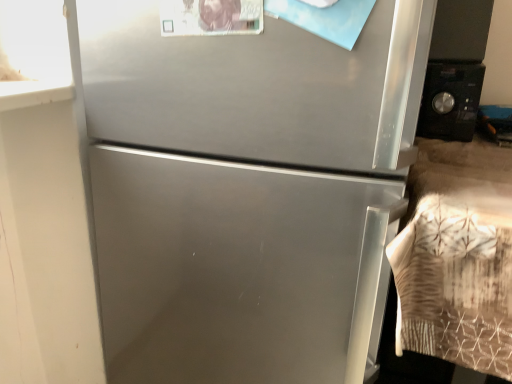
Find the location of a particular element. This screenshot has width=512, height=384. satin silver refrigerator at center is located at coordinates (247, 191).

The width and height of the screenshot is (512, 384). Describe the element at coordinates (247, 191) in the screenshot. I see `satin silver refrigerator at center` at that location.

This screenshot has height=384, width=512. In order to click on black matte microwave at right in this screenshot , I will do `click(450, 100)`.

Looking at this image, measure the distance between black matte microwave at right and camera.

The distance of black matte microwave at right from camera is 98.15 centimeters.

The width and height of the screenshot is (512, 384). Describe the element at coordinates (450, 100) in the screenshot. I see `black matte microwave at right` at that location.

Locate an element on the screen. Image resolution: width=512 pixels, height=384 pixels. satin silver refrigerator at center is located at coordinates (247, 191).

Does satin silver refrigerator at center appear on the left side of black matte microwave at right?

Correct, you'll find satin silver refrigerator at center to the left of black matte microwave at right.

Considering the positions of objects satin silver refrigerator at center and black matte microwave at right in the image provided, who is in front, satin silver refrigerator at center or black matte microwave at right?

Positioned in front is satin silver refrigerator at center.

Considering the positions of points (250, 291) and (424, 88), is point (250, 291) farther from camera compared to point (424, 88)?

No, it is in front of (424, 88).

From the image's perspective, does satin silver refrigerator at center appear lower than black matte microwave at right?

Indeed, from the image's perspective, satin silver refrigerator at center is shown beneath black matte microwave at right.

From a real-world perspective, is satin silver refrigerator at center positioned under black matte microwave at right based on gravity?

Correct, in the physical world, satin silver refrigerator at center is lower than black matte microwave at right.

Is satin silver refrigerator at center wider than black matte microwave at right?

Correct, the width of satin silver refrigerator at center exceeds that of black matte microwave at right.

Can you confirm if satin silver refrigerator at center is shorter than black matte microwave at right?

In fact, satin silver refrigerator at center may be taller than black matte microwave at right.

Which of these two, satin silver refrigerator at center or black matte microwave at right, is bigger?

With larger size is satin silver refrigerator at center.

Which is correct: satin silver refrigerator at center is inside black matte microwave at right, or outside of it?

satin silver refrigerator at center cannot be found inside black matte microwave at right.

Is satin silver refrigerator at center touching black matte microwave at right?

They are not placed beside each other.

Could you tell me if satin silver refrigerator at center is facing black matte microwave at right?

No, satin silver refrigerator at center is not turned towards black matte microwave at right.

How different are the orientations of satin silver refrigerator at center and black matte microwave at right in degrees?

The facing directions of satin silver refrigerator at center and black matte microwave at right are 7.25 degrees apart.

Measure the distance between satin silver refrigerator at center and black matte microwave at right.

satin silver refrigerator at center is 22.62 inches away from black matte microwave at right.

Identify the location of appliance behind the satin silver refrigerator at center. This screenshot has height=384, width=512. (450, 100).

Which object is positioned more to the left, black matte microwave at right or satin silver refrigerator at center?

Positioned to the left is satin silver refrigerator at center.

Based on the photo, which is in front, black matte microwave at right or satin silver refrigerator at center?

Positioned in front is satin silver refrigerator at center.

Does point (445, 64) lie behind point (187, 349)?

Yes, it is.

From the image's perspective, is black matte microwave at right positioned above or below satin silver refrigerator at center?

black matte microwave at right is above satin silver refrigerator at center.

From a real-world perspective, is black matte microwave at right over satin silver refrigerator at center?

Yes.

Which object is thinner, black matte microwave at right or satin silver refrigerator at center?

Thinner between the two is black matte microwave at right.

In the scene shown: Considering the sizes of objects black matte microwave at right and satin silver refrigerator at center in the image provided, who is shorter, black matte microwave at right or satin silver refrigerator at center?

With less height is black matte microwave at right.

Is black matte microwave at right bigger than satin silver refrigerator at center?

Incorrect, black matte microwave at right is not larger than satin silver refrigerator at center.

Would you say black matte microwave at right is outside satin silver refrigerator at center?

Yes, black matte microwave at right is not within satin silver refrigerator at center.

Is black matte microwave at right in contact with satin silver refrigerator at center?

black matte microwave at right and satin silver refrigerator at center are not in contact.

Does black matte microwave at right turn towards satin silver refrigerator at center?

No, black matte microwave at right is not turned towards satin silver refrigerator at center.

What's the angular difference between black matte microwave at right and satin silver refrigerator at center's facing directions?

7.25 degrees separate the facing orientations of black matte microwave at right and satin silver refrigerator at center.

Measure the distance between black matte microwave at right and satin silver refrigerator at center.

They are 22.62 inches apart.

You are a GUI agent. You are given a task and a screenshot of the screen. Output one action in this format:
    pyautogui.click(x=<x>, y=<y>)
    Task: Click on the refrigerator on the left side of black matte microwave at right
    The image size is (512, 384).
    Given the screenshot: What is the action you would take?
    pyautogui.click(x=247, y=191)

The image size is (512, 384). Find the location of `refrigerator below the black matte microwave at right (from a real-world perspective)`. refrigerator below the black matte microwave at right (from a real-world perspective) is located at coordinates (247, 191).

At what (x,y) coordinates should I click in order to perform the action: click on refrigerator in front of the black matte microwave at right. Please return your answer as a coordinate pair (x, y). Looking at the image, I should click on (247, 191).